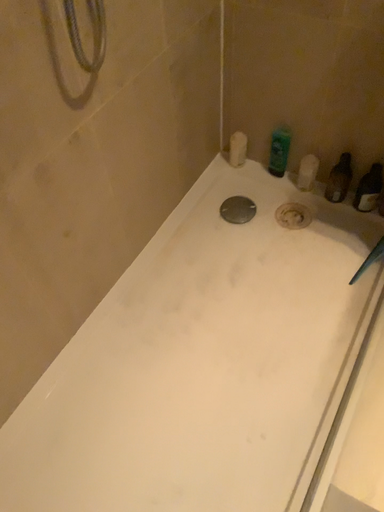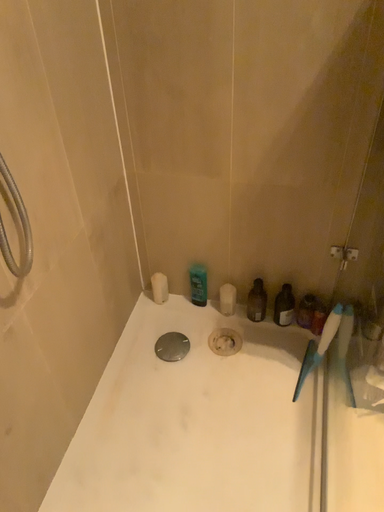
Question: Which way did the camera rotate in the video?

Choices:
 (A) rotated right
 (B) rotated left

Answer: (A)